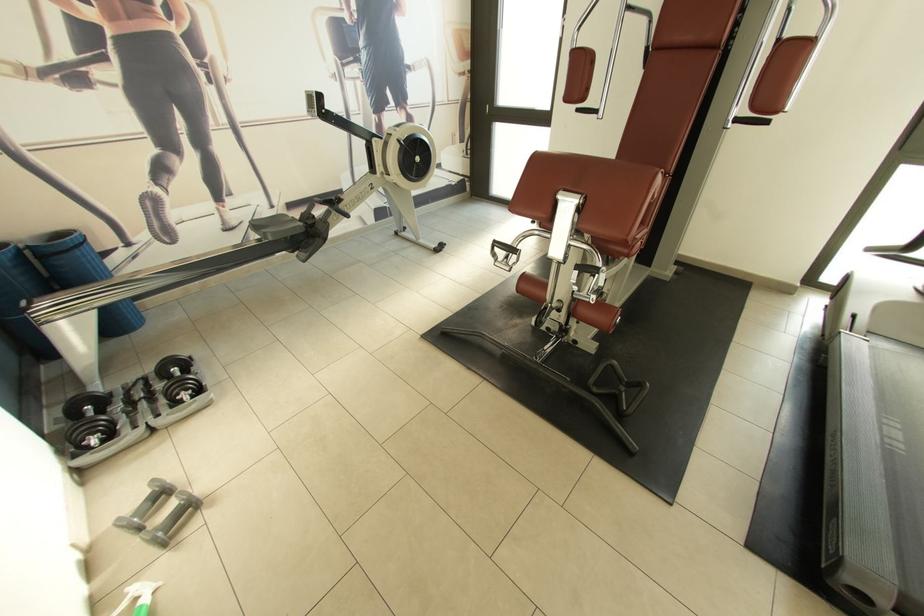
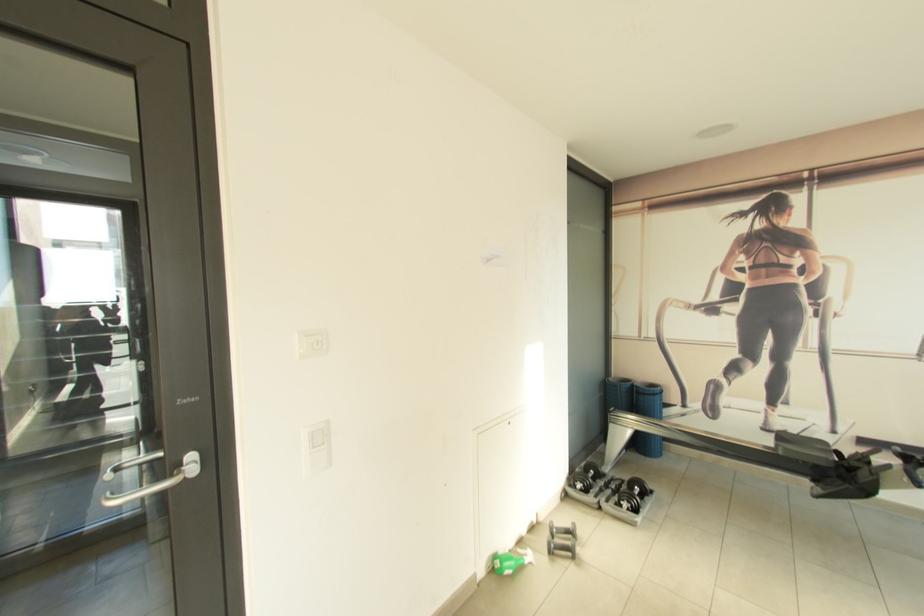
Question: The first image is from the beginning of the video and the second image is from the end. How did the camera likely rotate when shooting the video?

Choices:
 (A) Left
 (B) Right
 (C) Up
 (D) Down

Answer: (A)